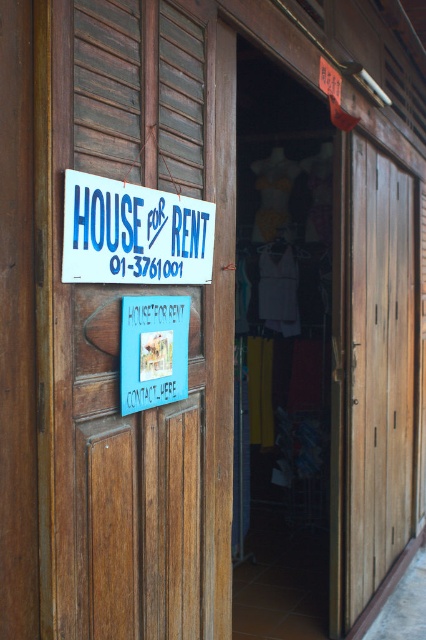
Locate an element on the screen. brown wooden door at right is located at coordinates (379, 369).

Is brown wooden door at right bigger than white plastic sign at upper left?

Indeed, brown wooden door at right has a larger size compared to white plastic sign at upper left.

Where is `brown wooden door at right`? brown wooden door at right is located at coordinates (379, 369).

Can you confirm if wooden door at left is bigger than brown wooden door at right?

No.

Is wooden door at left below brown wooden door at right?

Incorrect, wooden door at left is not positioned below brown wooden door at right.

Which is behind, point (224, 80) or point (367, 506)?

Point (367, 506)

Image resolution: width=426 pixels, height=640 pixels. Find the location of `wooden door at left`. wooden door at left is located at coordinates (118, 328).

Who is more forward, (195, 416) or (114, 237)?

Point (114, 237)

Is point (124, 74) more distant than point (106, 189)?

Yes, it is behind point (106, 189).

Find the location of a particular element. This screenshot has height=640, width=426. wooden door at left is located at coordinates (118, 328).